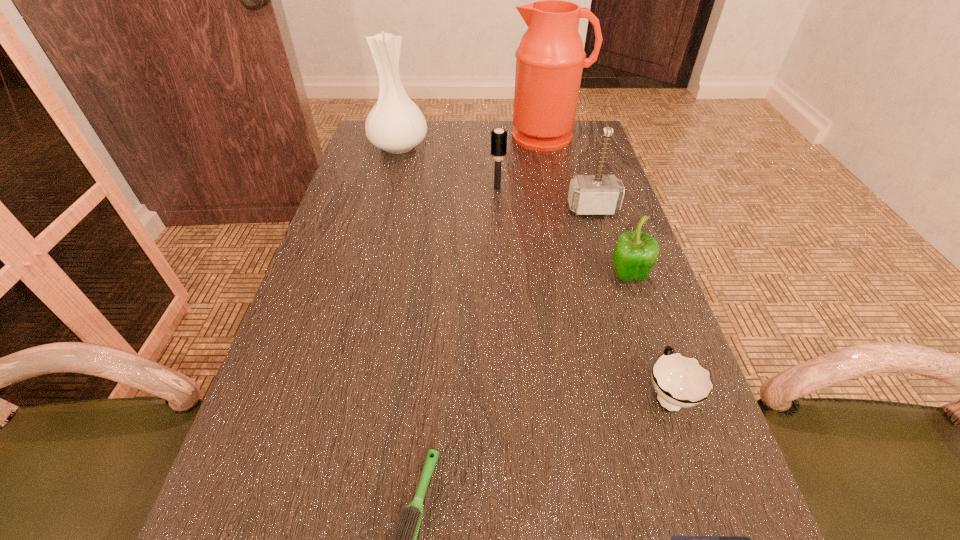
Where is `vacant space at the right edge of the desktop`? vacant space at the right edge of the desktop is located at coordinates (595, 342).

I want to click on free spot at the far right corner of the desktop, so click(x=571, y=149).

At what (x,y) coordinates should I click in order to perform the action: click on free space between the hammer and the sixth farthest object. Please return your answer as a coordinate pair (x, y). Looking at the image, I should click on (x=630, y=301).

Image resolution: width=960 pixels, height=540 pixels. I want to click on free space between the farther hairbrush and the third tallest object, so click(x=545, y=199).

At what (x,y) coordinates should I click in order to perform the action: click on free area in between the water jug and the sixth shortest object. Please return your answer as a coordinate pair (x, y). Looking at the image, I should click on (570, 173).

At what (x,y) coordinates should I click in order to perform the action: click on free space between the tallest object and the sixth shortest object. Please return your answer as a coordinate pair (x, y). This screenshot has height=540, width=960. Looking at the image, I should click on (570, 173).

Choose which object is the third nearest neighbor to the fourth shortest object. Please provide its 2D coordinates. Your answer should be formatted as a tuple, i.e. [(x, y)], where the tuple contains the x and y coordinates of a point satisfying the conditions above.

[(498, 143)]

Point out which object is positioned as the sixth nearest to the vase. Please provide its 2D coordinates. Your answer should be formatted as a tuple, i.e. [(x, y)], where the tuple contains the x and y coordinates of a point satisfying the conditions above.

[(405, 537)]

Locate an element on the screen. free spot that satisfies the following two spatial constraints: 1. for striking with the head of the fourth nearest object; 2. on the right side of the third tallest object is located at coordinates (613, 277).

You are a GUI agent. You are given a task and a screenshot of the screen. Output one action in this format:
    pyautogui.click(x=<x>, y=<y>)
    Task: Click on the vacant area that satisfies the following two spatial constraints: 1. on the front side of the fourth shortest object; 2. on the right side of the leftmost object
    Image resolution: width=960 pixels, height=540 pixels.
    Given the screenshot: What is the action you would take?
    (x=365, y=277)